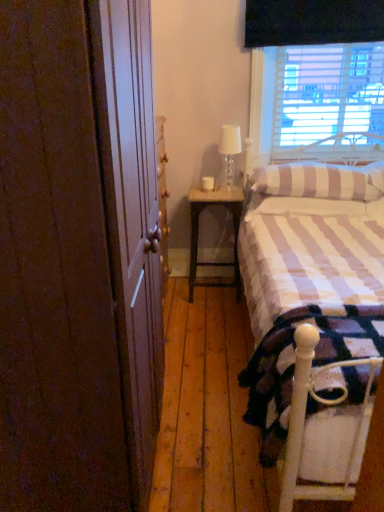
Question: Based on their positions, is white metal bed frame at lower right located to the left or right of wooden nightstand at center?

Choices:
 (A) left
 (B) right

Answer: (B)

Question: From the image's perspective, is white metal bed frame at lower right located above or below wooden nightstand at center?

Choices:
 (A) above
 (B) below

Answer: (B)

Question: Based on their relative distances, which object is nearer to the white metal bed frame at lower right?

Choices:
 (A) brown wood screen door at left
 (B) white textured bed at right
 (C) striped fabric pillow at upper right
 (D) translucent glass table lamp at upper right
 (E) wooden nightstand at center

Answer: (B)

Question: Which object is positioned farthest from the white metal bed frame at lower right?

Choices:
 (A) wooden nightstand at center
 (B) striped fabric pillow at upper right
 (C) white textured bed at right
 (D) brown wood screen door at left
 (E) translucent glass table lamp at upper right

Answer: (E)